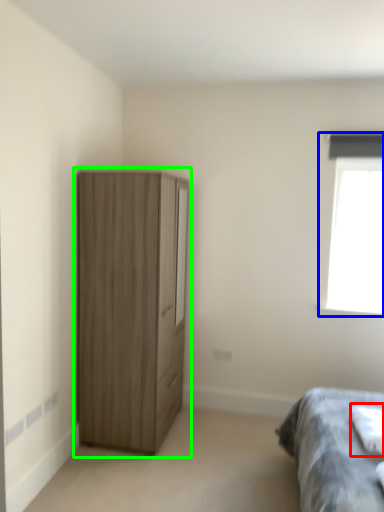
Question: Considering the real-world distances, which object is farthest from sheet (highlighted by a red box)? window (highlighted by a blue box) or cupboard (highlighted by a green box)?

Choices:
 (A) window
 (B) cupboard

Answer: (B)